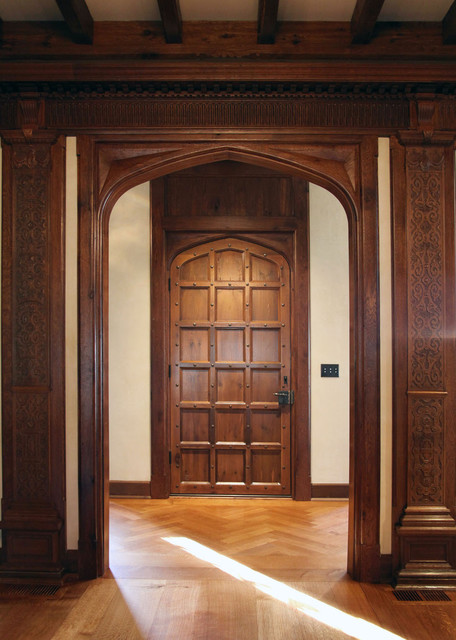
Locate an element on the screen. Image resolution: width=456 pixels, height=640 pixels. vent is located at coordinates (416, 594).